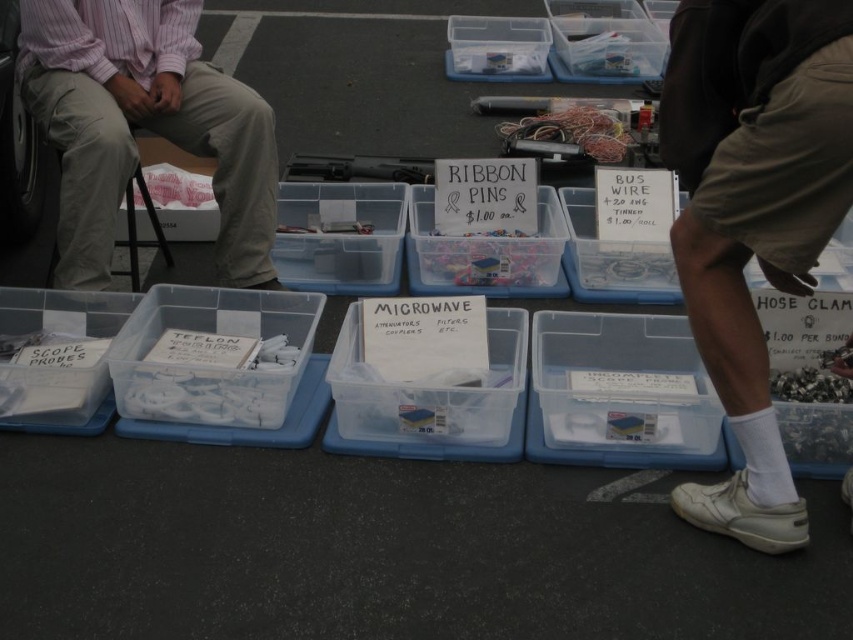
Question: Among these objects, which one is nearest to the camera?

Choices:
 (A) translucent plastic container at center
 (B) clear plastic box at center
 (C) white cotton socks at lower right
 (D) clear plastic container at center

Answer: (C)

Question: Can you confirm if white plastic scope probes at left is positioned below translucent plastic ribbon pins at center?

Choices:
 (A) yes
 (B) no

Answer: (A)

Question: Which is farther from the white cotton socks at lower right?

Choices:
 (A) translucent plastic container at center
 (B) translucent plastic ribbon pins at center

Answer: (B)

Question: Which object is closer to the camera taking this photo?

Choices:
 (A) clear plastic box at upper center
 (B) clear plastic box at center
 (C) white plastic scope probes at left

Answer: (C)

Question: Is clear plastic container at center to the right of clear plastic box at upper center from the viewer's perspective?

Choices:
 (A) no
 (B) yes

Answer: (A)

Question: Can you confirm if clear plastic microwave container at center is wider than clear plastic box at center?

Choices:
 (A) yes
 (B) no

Answer: (A)